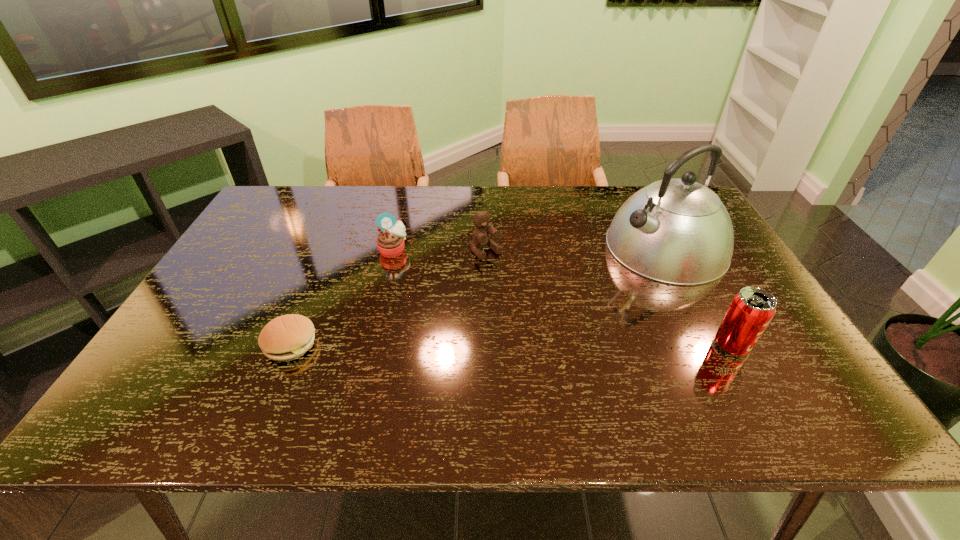
Find the location of `the leftmost object`. the leftmost object is located at coordinates (285, 338).

Image resolution: width=960 pixels, height=540 pixels. Find the location of `patty`. patty is located at coordinates (285, 338).

Identify the location of the fourth shortest object. (751, 310).

This screenshot has height=540, width=960. Find the location of `the third object from left to right`. the third object from left to right is located at coordinates (481, 239).

Find the location of a particular element. the second object from left to right is located at coordinates (390, 242).

At what (x,y) coordinates should I click in order to perform the action: click on kettle. Please return your answer as a coordinate pair (x, y). The width and height of the screenshot is (960, 540). Looking at the image, I should click on 677,231.

Locate an element on the screen. The image size is (960, 540). free space located 0.050m on the back of the patty is located at coordinates (304, 310).

Image resolution: width=960 pixels, height=540 pixels. Find the location of `free space located on the left of the second tallest object`. free space located on the left of the second tallest object is located at coordinates (612, 345).

The height and width of the screenshot is (540, 960). I want to click on free region located 0.080m on the face of the teddy bear, so click(509, 276).

Locate an element on the screen. The height and width of the screenshot is (540, 960). free space located 0.320m on the face of the teddy bear is located at coordinates (560, 334).